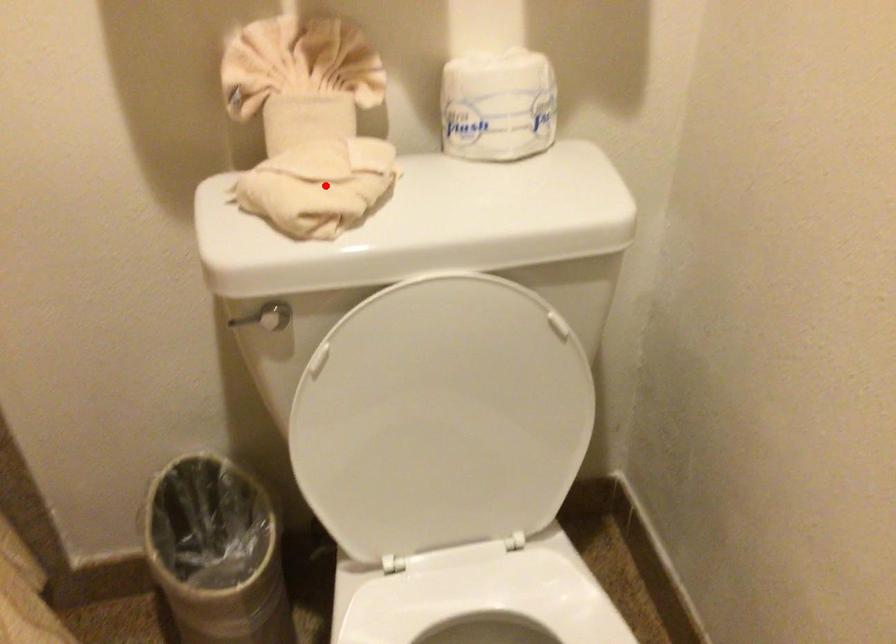
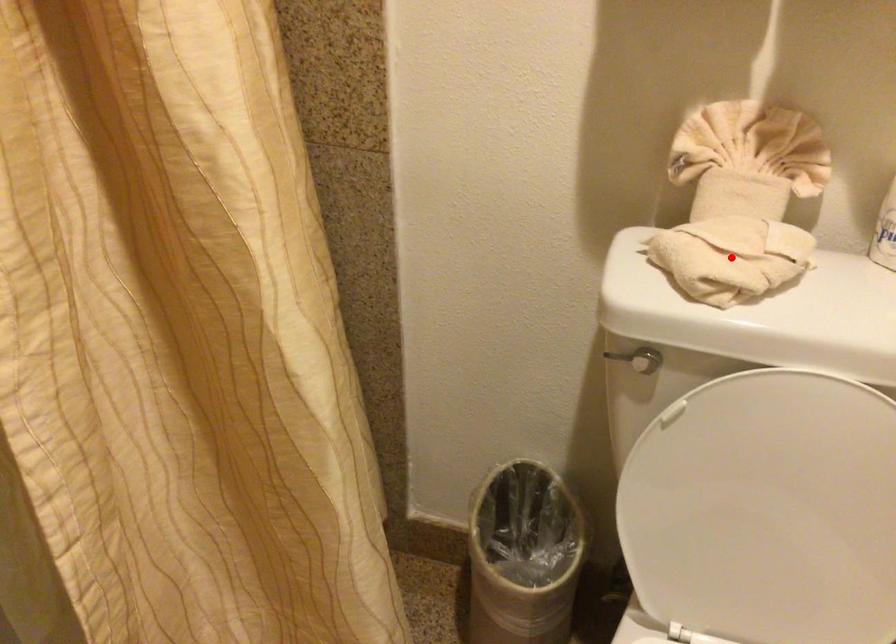
I am providing you with two images of the same scene from different viewpoints. A red point is marked on the first image and another point is marked on the second image. Do the highlighted points in image1 and image2 indicate the same real-world spot?

Yes